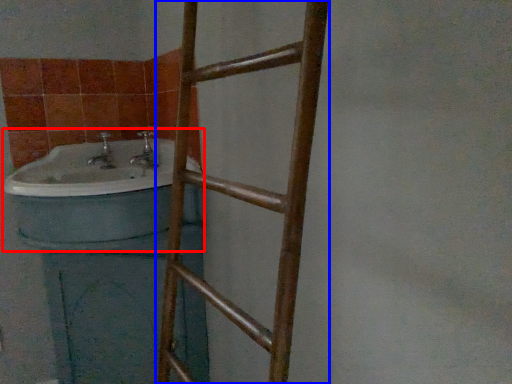
Question: Which of the following is the closest to the observer, sink (highlighted by a red box) or ladder (highlighted by a blue box)?

Choices:
 (A) sink
 (B) ladder

Answer: (B)